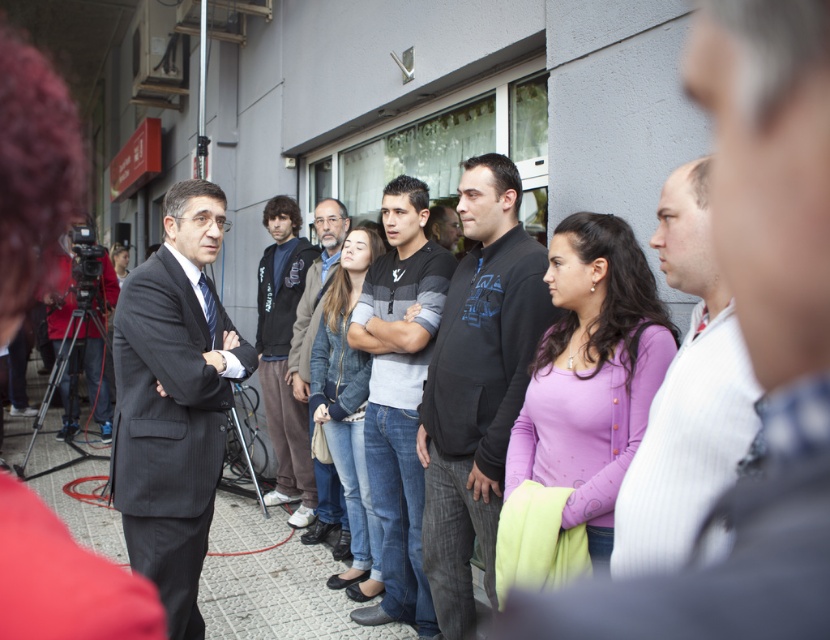
Find the location of a particular element. The width and height of the screenshot is (830, 640). dark gray pinstripe suit at center is located at coordinates (174, 401).

Is dark gray pinstripe suit at center bigger than gray striped sweater at center?

Incorrect, dark gray pinstripe suit at center is not larger than gray striped sweater at center.

Is point (166, 381) less distant than point (420, 234)?

Yes, it is in front of point (420, 234).

Image resolution: width=830 pixels, height=640 pixels. I want to click on dark gray pinstripe suit at center, so click(174, 401).

Between point (731, 282) and point (301, 396), which one is positioned behind?

The point (301, 396) is behind.

Does black shirt at center have a larger size compared to gray knit sweater at center?

Incorrect, black shirt at center is not larger than gray knit sweater at center.

Who is more distant from viewer, (809, 456) or (306, 378)?

Point (306, 378)

Where is `black shirt at center`? The image size is (830, 640). black shirt at center is located at coordinates (749, 342).

Who is positioned more to the right, dark gray sweater at center or striped shirt at center?

Positioned to the right is striped shirt at center.

Looking at this image, is dark gray sweater at center in front of striped shirt at center?

No, it is behind striped shirt at center.

Measure the distance between point [494,342] and camera.

Point [494,342] and camera are 8.87 feet apart.

Identify the location of dark gray sweater at center. [477, 385].